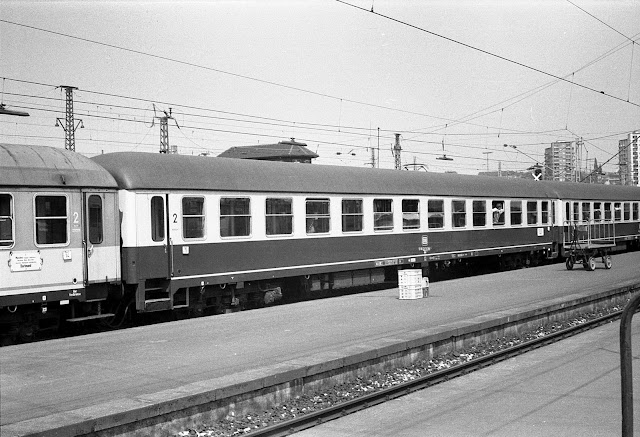
At what (x,y) coordinates should I click in order to perform the action: click on metal rectangular cart. Please return your answer as a coordinate pair (x, y). The image size is (640, 437). Looking at the image, I should click on (587, 246).